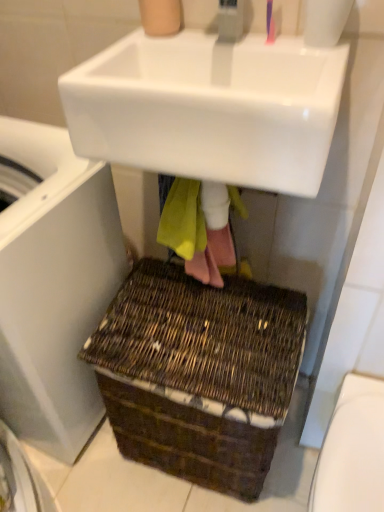
Where is `vacant area to the left of pink plastic toothbrush at upper center`? The image size is (384, 512). vacant area to the left of pink plastic toothbrush at upper center is located at coordinates (201, 46).